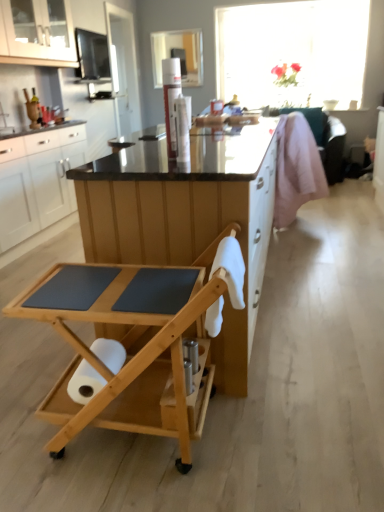
Question: Considering the relative positions of transparent glass vase at upper center and wooden rolling cart at center in the image provided, is transparent glass vase at upper center to the left or to the right of wooden rolling cart at center?

Choices:
 (A) left
 (B) right

Answer: (B)

Question: Considering the positions of transparent glass vase at upper center and wooden rolling cart at center in the image, is transparent glass vase at upper center wider or thinner than wooden rolling cart at center?

Choices:
 (A) thin
 (B) wide

Answer: (A)

Question: Considering the real-world distances, which object is farthest from the white matte cabinet at left, which appears as the 2th cabinetry when viewed from the top?

Choices:
 (A) transparent glass vase at upper center
 (B) pink fabric swivel chair at right
 (C) white matte toilet paper at lower left
 (D) white glossy cabinet at upper left, placed as the 1th cabinetry when sorted from top to bottom
 (E) natural wood rolling cart at center

Answer: (A)

Question: Considering the real-world distances, which object is closest to the transparent glass vase at upper center?

Choices:
 (A) natural wood rolling cart at center
 (B) white matte toilet paper at lower left
 (C) white matte cabinet at left, which appears as the 2th cabinetry when viewed from the top
 (D) pink fabric swivel chair at right
 (E) white glossy cabinet at upper left, placed as the 1th cabinetry when sorted from top to bottom

Answer: (D)